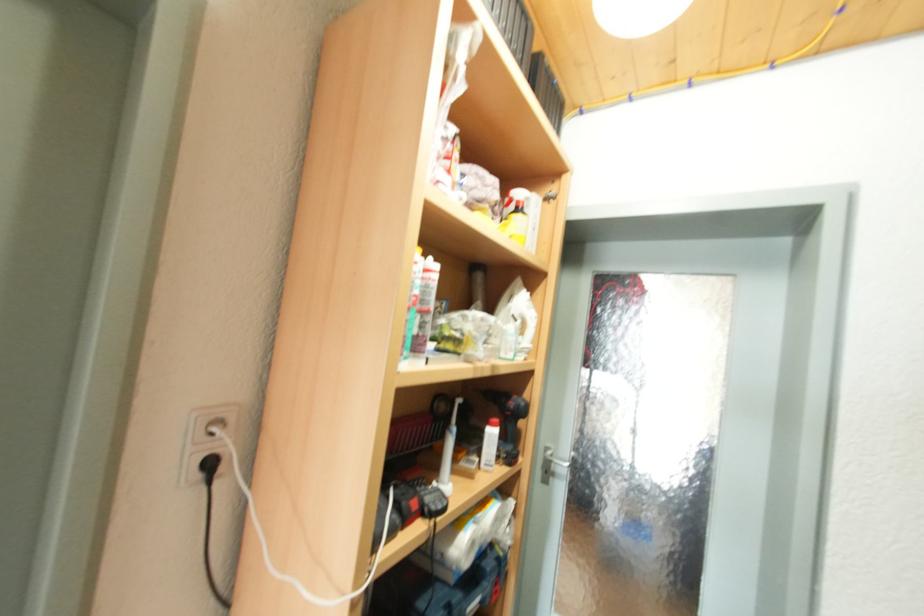
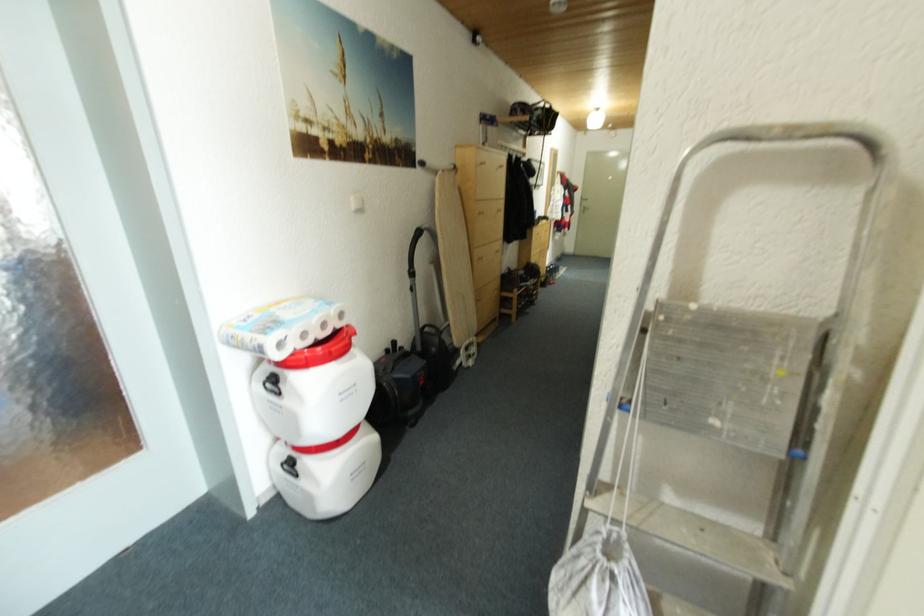
The images are taken continuously from a first-person perspective. In which direction is your viewpoint rotating?

The camera's rotation is toward right-down.